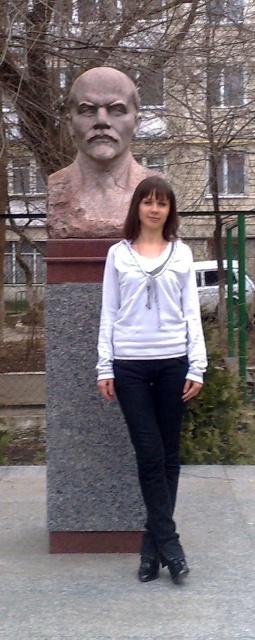
Which is more to the left, white cotton hoodie at center or brown stone bust at center?

From the viewer's perspective, brown stone bust at center appears more on the left side.

Image resolution: width=255 pixels, height=640 pixels. I want to click on white cotton hoodie at center, so click(x=151, y=356).

Find the location of `white cotton hoodie at center`. white cotton hoodie at center is located at coordinates point(151,356).

From the picture: Measure the distance between white cotton hoodie at center and camera.

11.69 feet

Who is lower down, white cotton hoodie at center or white matte shirt at center?

white cotton hoodie at center is below.

Who is more distant from viewer, (156,460) or (145,316)?

The point (145,316) is more distant.

This screenshot has height=640, width=255. What are the coordinates of `white cotton hoodie at center` in the screenshot? It's located at (151, 356).

Is brown stone bust at center to the left of white matte shirt at center from the viewer's perspective?

Correct, you'll find brown stone bust at center to the left of white matte shirt at center.

Does brown stone bust at center have a greater width compared to white matte shirt at center?

Correct, the width of brown stone bust at center exceeds that of white matte shirt at center.

Find the location of a particular element. This screenshot has height=640, width=255. brown stone bust at center is located at coordinates (96, 157).

Identify the location of brown stone bust at center. Image resolution: width=255 pixels, height=640 pixels. (96, 157).